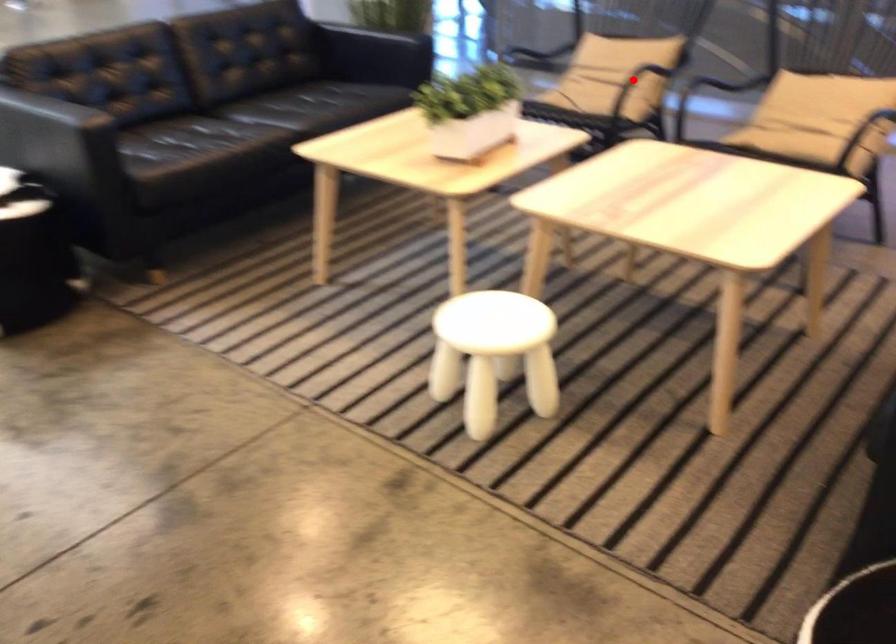
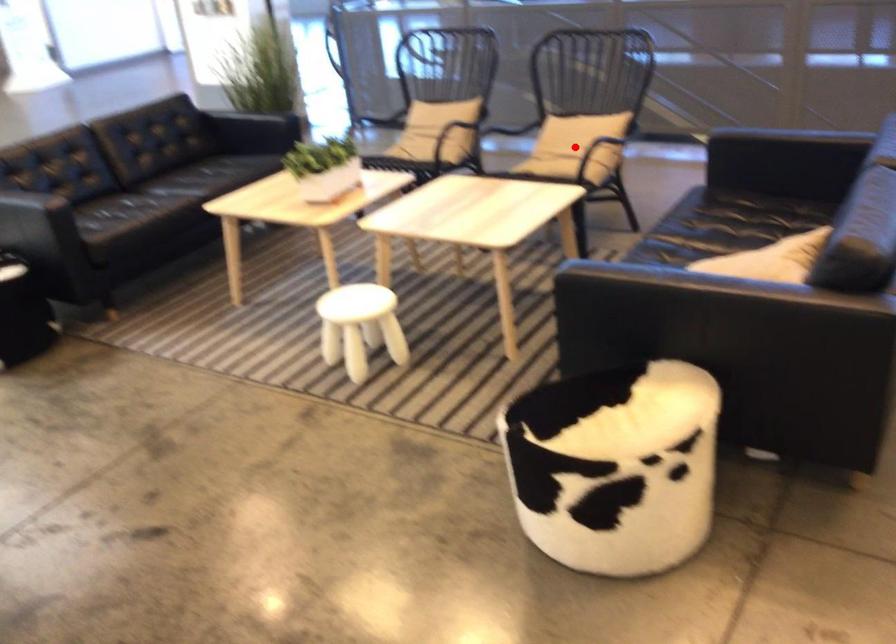
I am providing you with two images of the same scene from different viewpoints. A red point is marked on the first image and another point is marked on the second image. Are the points marked in image1 and image2 representing the same 3D position?

No